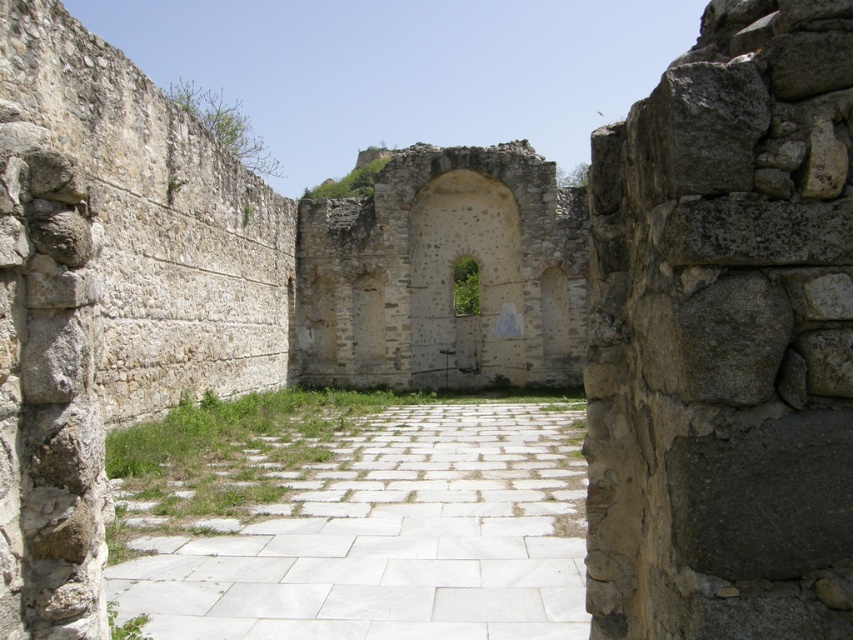
Question: Which point is farther to the camera?

Choices:
 (A) (497, 212)
 (B) (402, 506)

Answer: (A)

Question: Which point is closer to the camera taking this photo?

Choices:
 (A) (502, 428)
 (B) (341, 305)
 (C) (485, 189)

Answer: (A)

Question: Observing the image, what is the correct spatial positioning of white stone path at center in reference to stone textured archway at center?

Choices:
 (A) below
 (B) above

Answer: (A)

Question: Is white stone path at center positioned behind stone archway at center?

Choices:
 (A) no
 (B) yes

Answer: (A)

Question: Which point is closer to the camera?

Choices:
 (A) (454, 362)
 (B) (486, 339)

Answer: (B)

Question: Is white stone path at center above stone textured archway at center?

Choices:
 (A) no
 (B) yes

Answer: (A)